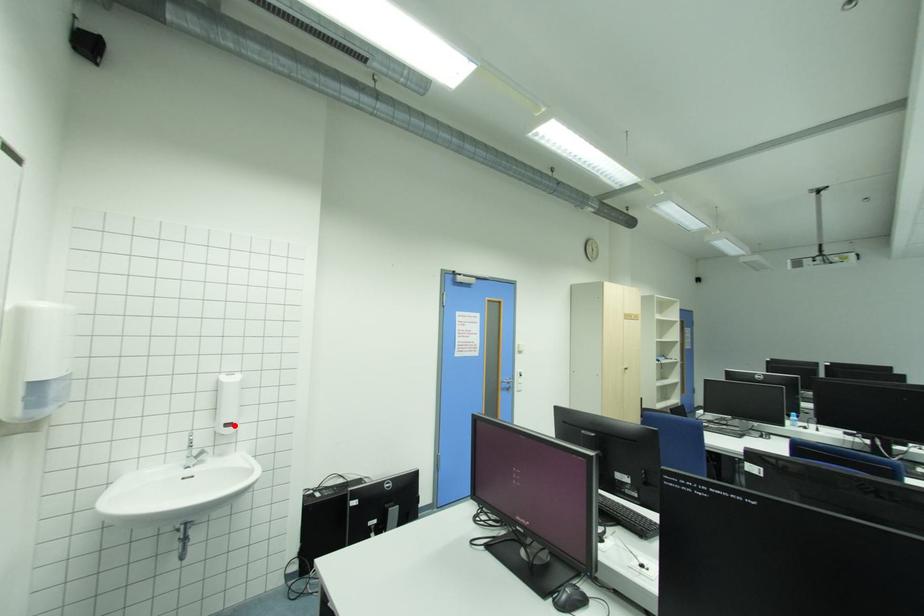
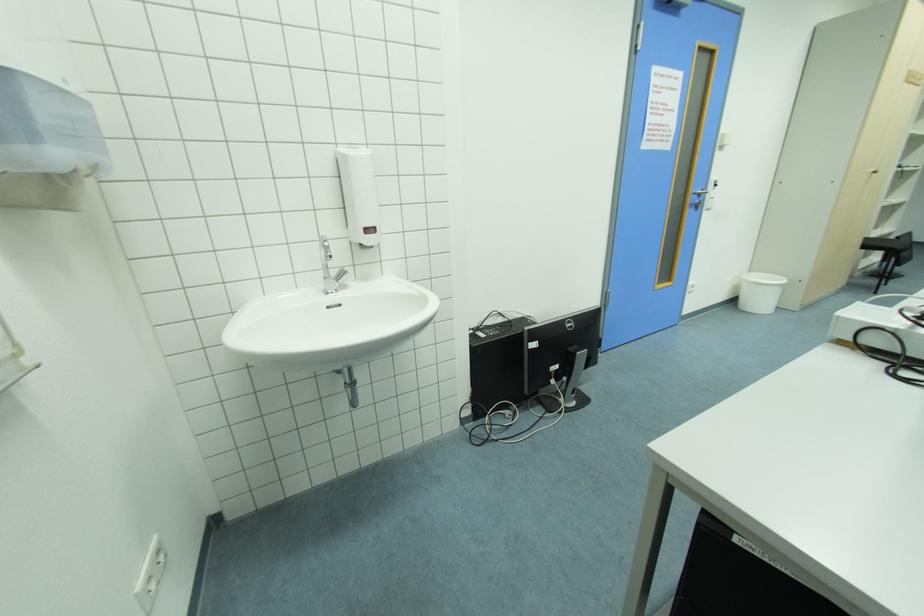
In the second image, find the point that corresponds to the highlighted location in the first image.

(375, 232)